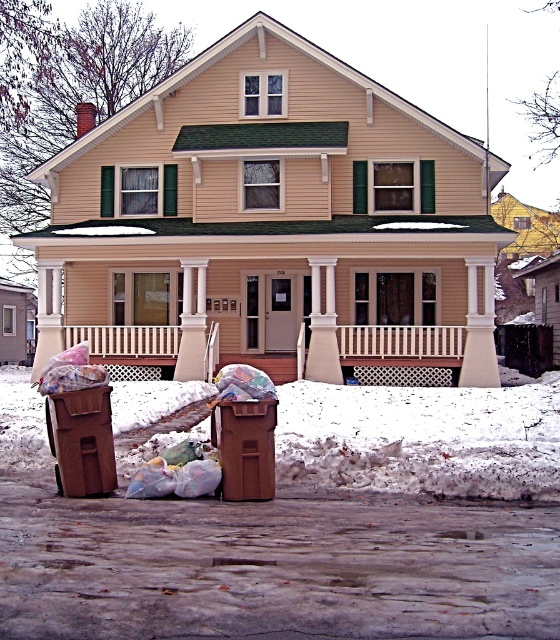
You are standing in front of the house and see the point marked at coordinates [178,472]. What object is located at that point?

The point at coordinates [178,472] marks translucent plastic bags at lower center.

Consider the image. You are standing in front of the house and want to place a new trash bin between the two existing ones. The first existing trash bin is at point (193, 342) and the second is at point (81, 355). Which existing trash bin is closer to you so you can place the new one appropriately?

The point (81, 355) is closer to you than point (193, 342), so the second trash bin is closer. Place the new bin between them accordingly.

You are standing in front of the house and see the white fluffy snow at lower center and the translucent plastic bags at lower center. Which object is located to the right of the other?

The white fluffy snow at lower center is located to the right of the translucent plastic bags at lower center.